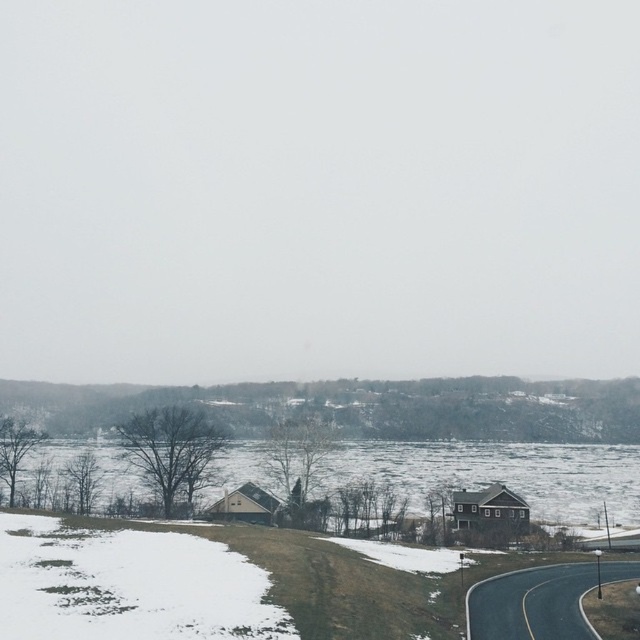
Does point (413, 413) come in front of point (113, 536)?

No, (413, 413) is further to viewer.

Is snowy grassy hill at center taller than white powdery snow at lower left?

Indeed, snowy grassy hill at center has a greater height compared to white powdery snow at lower left.

Who is more forward, (500, 403) or (122, 632)?

Point (122, 632)

Where is `snowy grassy hill at center`? The width and height of the screenshot is (640, 640). snowy grassy hill at center is located at coordinates (364, 406).

Can you confirm if brown wooden house at center is thinner than snowy grassy hill at center?

No, brown wooden house at center is not thinner than snowy grassy hill at center.

Is brown wooden house at center positioned behind snowy grassy hill at center?

No.

Is point (401, 428) closer to camera compared to point (76, 397)?

No, it is behind (76, 397).

The image size is (640, 640). Find the location of `brown wooden house at center`. brown wooden house at center is located at coordinates (388, 438).

Consider the image. Does brown wooden house at center appear under white powdery snow at lower left?

No.

Can you confirm if brown wooden house at center is wider than white powdery snow at lower left?

Correct, the width of brown wooden house at center exceeds that of white powdery snow at lower left.

Between point (618, 481) and point (93, 589), which one is positioned behind?

Positioned behind is point (618, 481).

Where is `brown wooden house at center`? The height and width of the screenshot is (640, 640). brown wooden house at center is located at coordinates (388, 438).